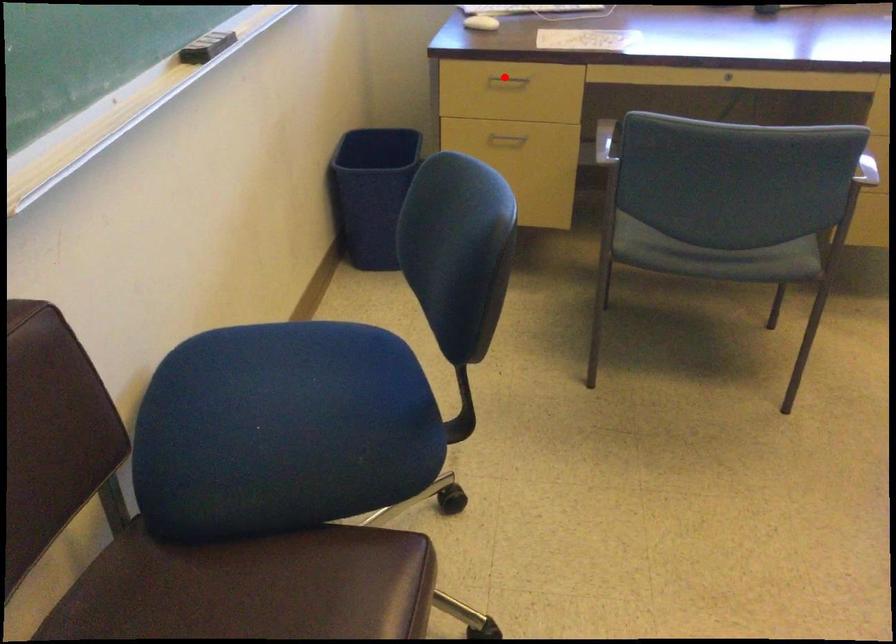
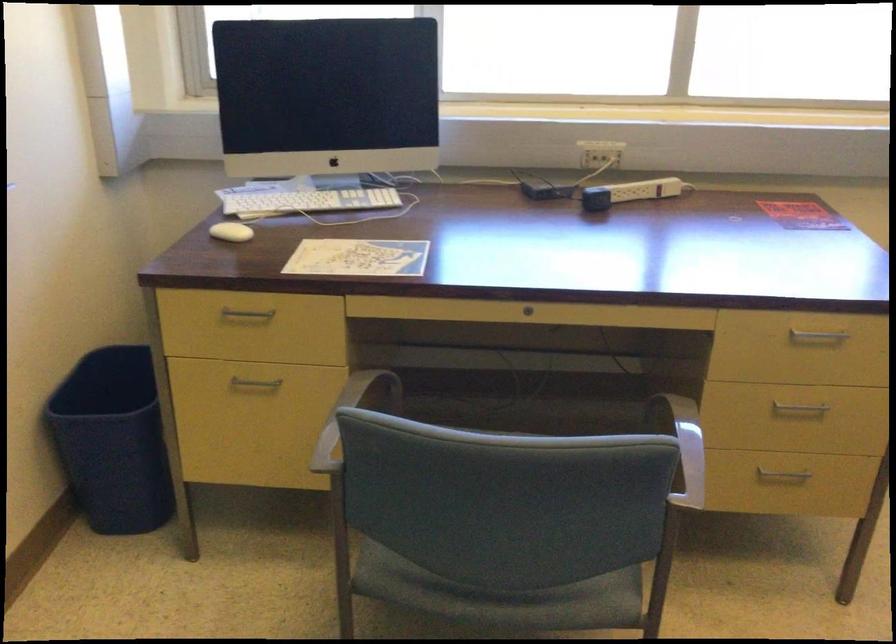
Question: A red point is marked in image1. In image2, is the corresponding 3D point closer to the camera or farther? Reply with the corresponding letter.

Choices:
 (A) The corresponding 3D point is closer.
 (B) The corresponding 3D point is farther.

Answer: (A)